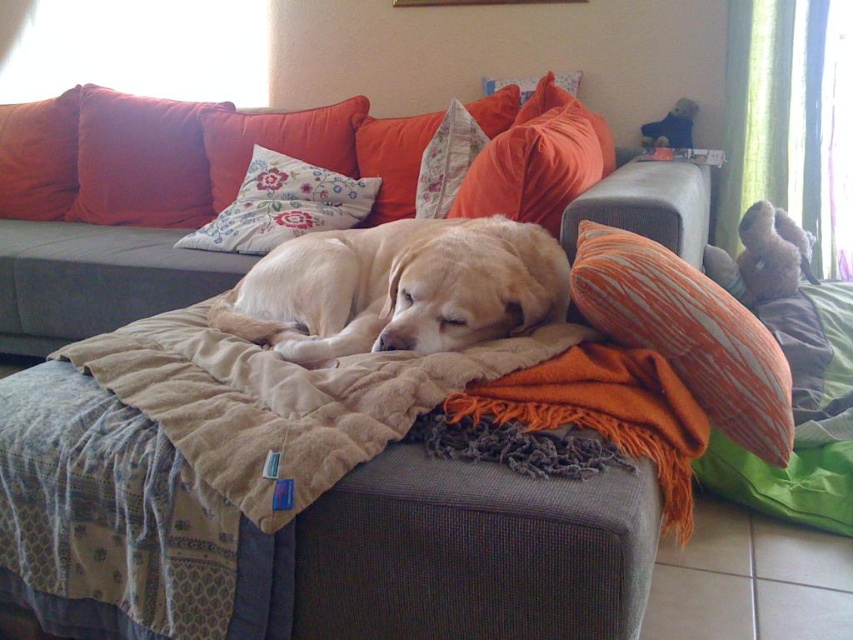
Question: Does orange striped pillow at right have a greater width compared to orange fabric pillow at upper left?

Choices:
 (A) yes
 (B) no

Answer: (B)

Question: Considering the relative positions of beige soft blanket at center and matte orange pillow at upper left in the image provided, where is beige soft blanket at center located with respect to matte orange pillow at upper left?

Choices:
 (A) above
 (B) below

Answer: (B)

Question: Estimate the real-world distances between objects in this image. Which object is farther from the floral fabric pillow at upper center?

Choices:
 (A) golden fur dog at center
 (B) orange fabric pillow at upper left
 (C) floral fabric pillow at center

Answer: (B)

Question: Which object appears farthest from the camera in this image?

Choices:
 (A) golden fur dog at center
 (B) floral fabric pillow at upper center
 (C) beige soft blanket at center
 (D) floral fabric pillow at center

Answer: (B)

Question: Estimate the real-world distances between objects in this image. Which object is closer to the floral fabric pillow at upper left?

Choices:
 (A) orange fabric pillow at upper left
 (B) golden fur dog at center

Answer: (A)

Question: Is golden fur dog at center further to the viewer compared to orange striped pillow at right?

Choices:
 (A) no
 (B) yes

Answer: (B)